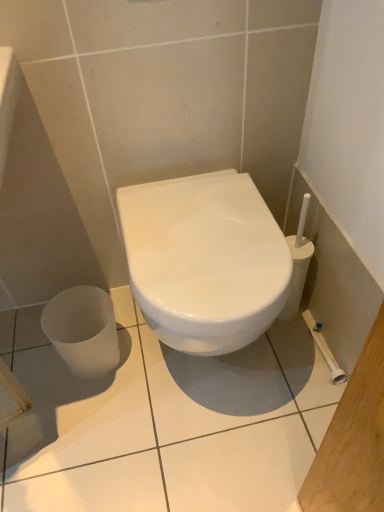
You are a GUI agent. You are given a task and a screenshot of the screen. Output one action in this format:
    pyautogui.click(x=<x>, y=<y>)
    Task: Click on the free spot in front of white glossy toilet at center
    This screenshot has width=384, height=512.
    Given the screenshot: What is the action you would take?
    pyautogui.click(x=196, y=458)